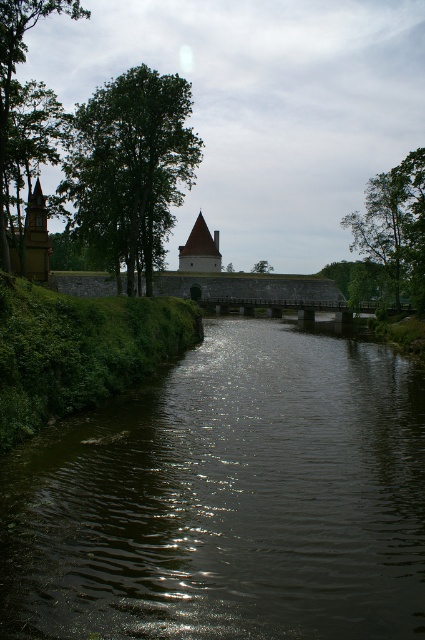
Question: Is green leafy tree at left to the left of smooth white tower at center from the viewer's perspective?

Choices:
 (A) yes
 (B) no

Answer: (A)

Question: Which point is farther to the camera?

Choices:
 (A) dark reflective water at center
 (B) green leafy tree at upper left

Answer: (B)

Question: Observing the image, what is the correct spatial positioning of dark reflective water at center in reference to green leafy tree at left?

Choices:
 (A) left
 (B) right

Answer: (B)

Question: Which point is closer to the camera?

Choices:
 (A) dark reflective water at center
 (B) green leafy tree at upper right

Answer: (A)

Question: Which point appears closest to the camera in this image?

Choices:
 (A) (130, 221)
 (B) (265, 268)
 (C) (207, 257)

Answer: (A)

Question: Where is green leafy tree at upper right located in relation to smooth white tower at center in the image?

Choices:
 (A) right
 (B) left

Answer: (A)